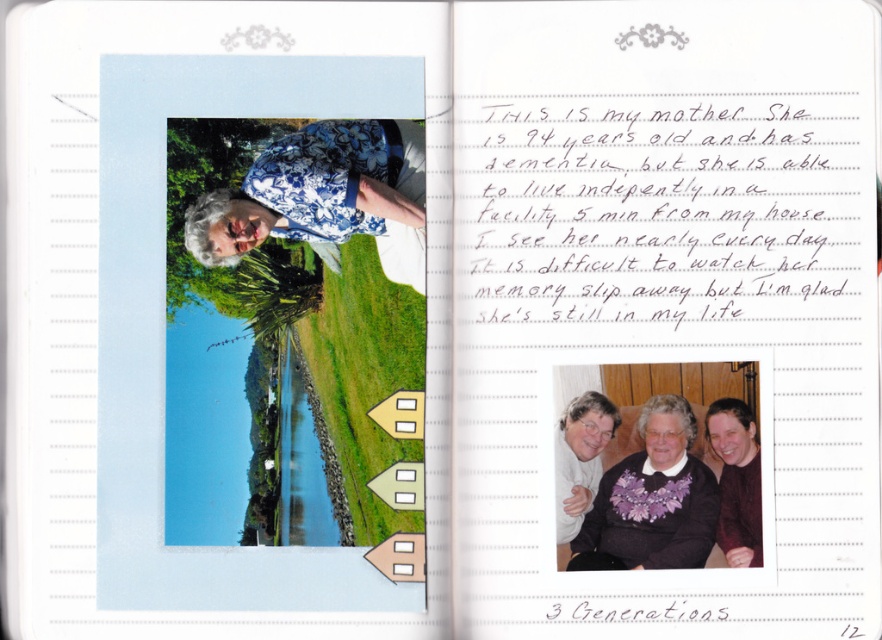
Who is positioned more to the left, purple fabric at center or maroon sweater at center?

From the viewer's perspective, purple fabric at center appears more on the left side.

Does purple fabric at center have a lesser height compared to maroon sweater at center?

No, purple fabric at center is not shorter than maroon sweater at center.

Is point (602, 486) positioned behind point (718, 528)?

Yes, it is behind point (718, 528).

Find the location of a particular element. The image size is (882, 640). purple fabric at center is located at coordinates (652, 499).

Who is shorter, blue floral shirt at center or maroon sweater at center?

blue floral shirt at center is shorter.

Between blue floral shirt at center and maroon sweater at center, which one appears on the left side from the viewer's perspective?

blue floral shirt at center

Who is more distant from viewer, (x=223, y=193) or (x=750, y=426)?

Positioned behind is point (x=223, y=193).

This screenshot has width=882, height=640. I want to click on blue floral shirt at center, so click(x=324, y=196).

Who is shorter, blue floral shirt at center or purple fabric at center?

blue floral shirt at center

This screenshot has width=882, height=640. I want to click on blue floral shirt at center, so click(324, 196).